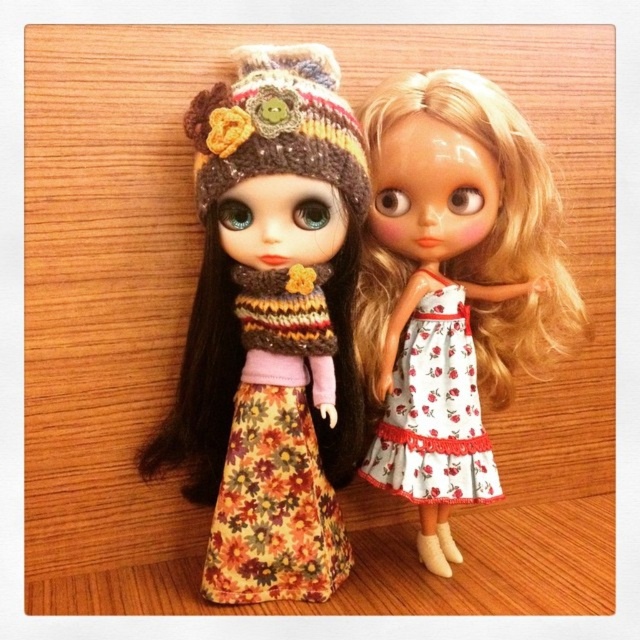
You are an interior designer planning to place a new decorative item in a room. You see the point marked at coordinates point (269,326). Can you determine if this point is located on the floral fabric dress at center?

The point (269,326) corresponds to the floral fabric dress at center, so yes, the point is located on the floral fabric dress at center.

You are standing in front of the dolls and want to place a sticker on the point that is closer to you. Which point should you choose between point (332, 474) and point (417, 488)?

Point (417, 488) is closer to you since point (332, 474) is behind it.